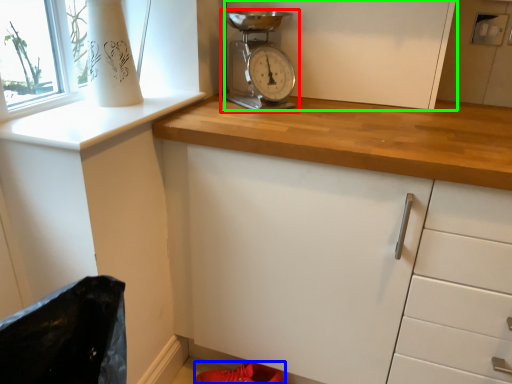
Question: Based on their relative distances, which object is farther from home appliance (highlighted by a red box)? Choose from footwear (highlighted by a blue box) and cabinetry (highlighted by a green box).

Choices:
 (A) footwear
 (B) cabinetry

Answer: (A)